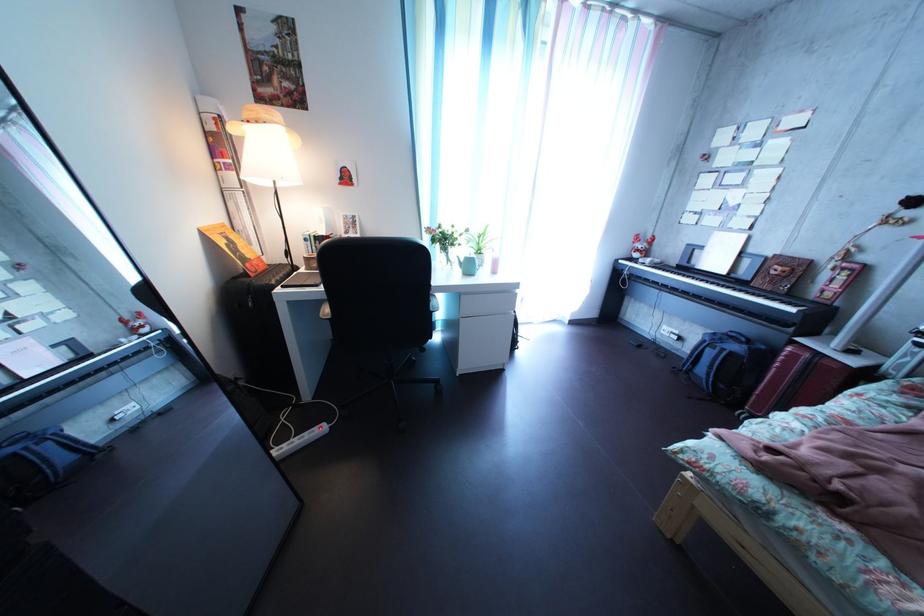
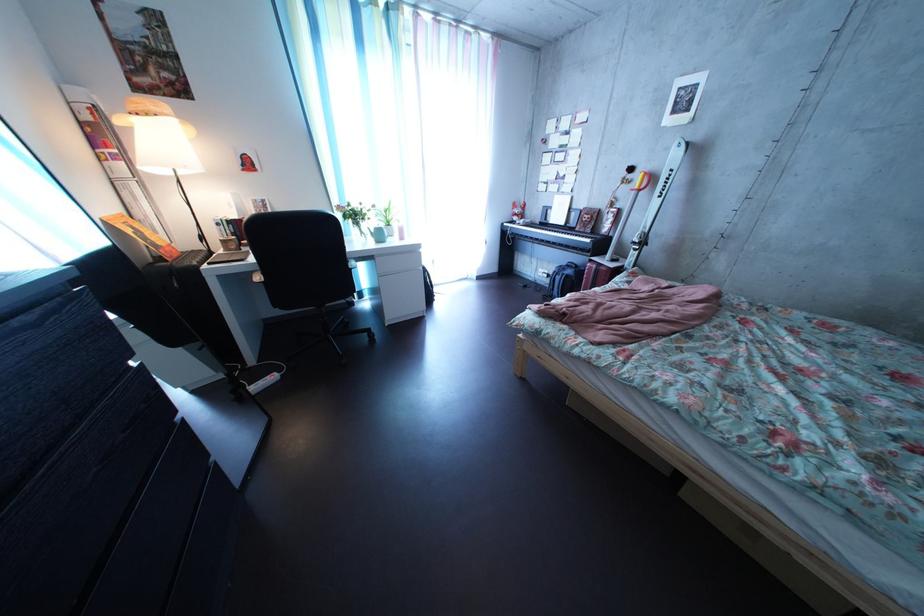
Find the pixel in the second image that matches (237,251) in the first image.

(142, 238)